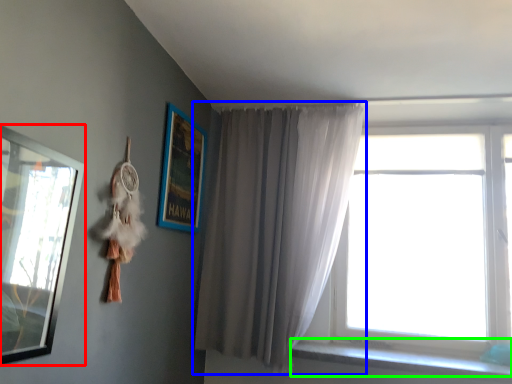
Question: Based on their relative distances, which object is farther from picture frame (highlighted by a red box)? Choose from curtain (highlighted by a blue box) and window sill (highlighted by a green box).

Choices:
 (A) curtain
 (B) window sill

Answer: (B)